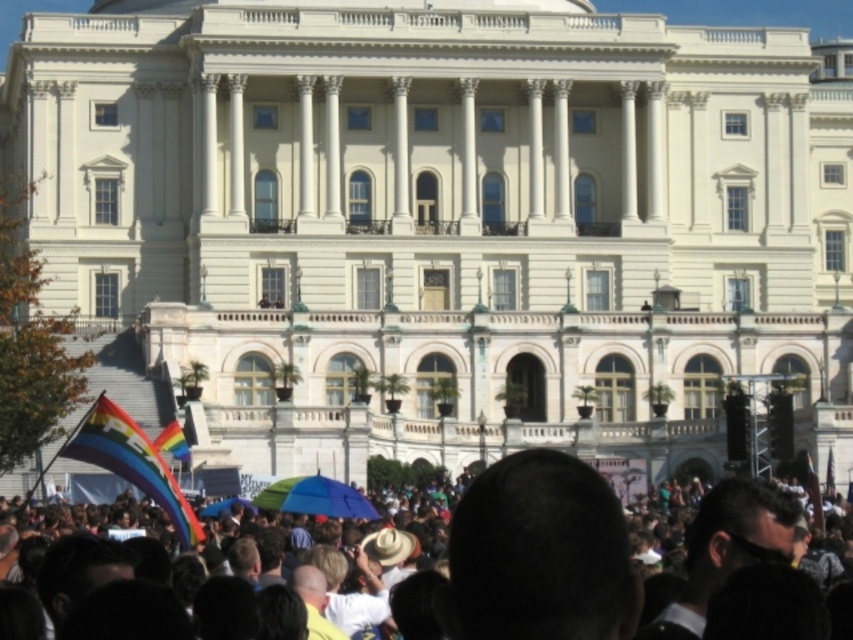
You are standing at the point closest to the building in the image. Which of the two points, point (697, 515) or point (309, 490), is farther away from you?

Point (309, 490) is farther away from you because it is behind point (697, 515).

You are a photographer trying to capture the rainbow fabric umbrella at center without the rainbow fabric crowd at lower center blocking it. Given their sizes, which object would you need to adjust your camera angle to avoid?

The rainbow fabric crowd at lower center is larger in size than the rainbow fabric umbrella at center, so you would need to adjust your camera angle to avoid the rainbow fabric crowd at lower center blocking the umbrella.

You are a photographer planning to take a photo of the rainbow fabric umbrella at center. You want to ensure the rainbow fabric crowd at lower center doesn not block the umbrella. Given their sizes, can you position yourself in a way that the umbrella is fully visible without the crowd covering it?

The rainbow fabric crowd at lower center is wider than the rainbow fabric umbrella at center. Positioning yourself higher or moving to a side angle might help to see the umbrella fully, as the crowd might block parts of it due to their larger width.